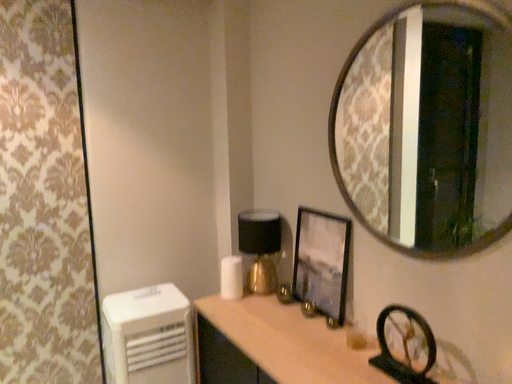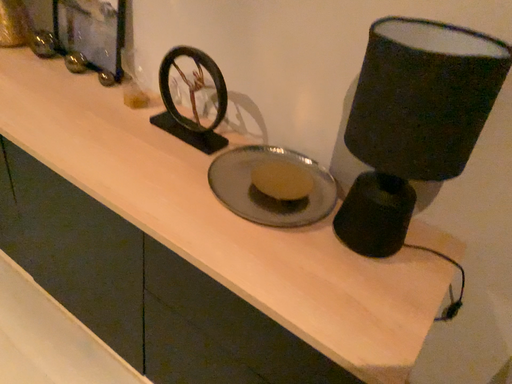
Question: How did the camera likely rotate when shooting the video?

Choices:
 (A) rotated downward
 (B) rotated upward

Answer: (A)